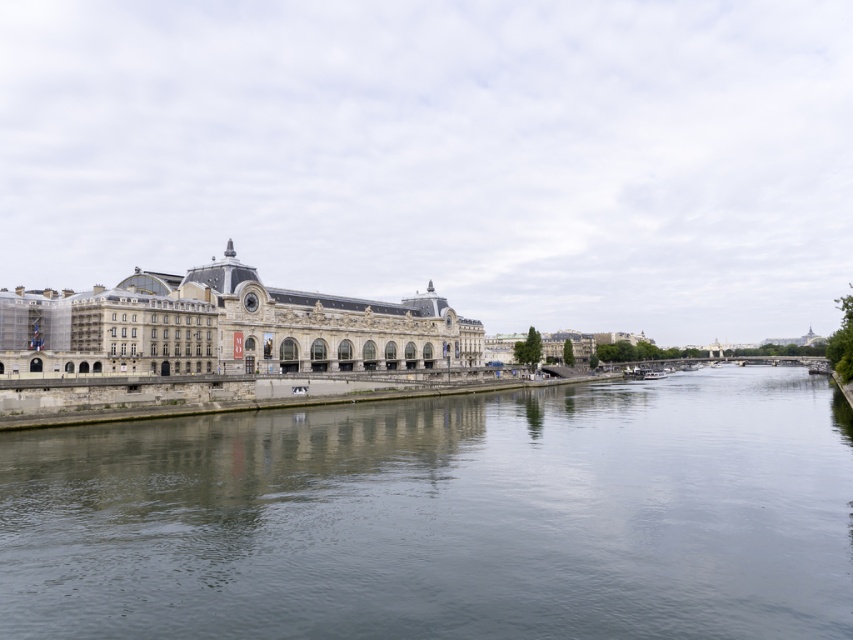
Which of these two, smooth gray water at center or stone building at center, stands shorter?

Standing shorter between the two is smooth gray water at center.

Is smooth gray water at center below stone building at center?

Yes, smooth gray water at center is below stone building at center.

I want to click on smooth gray water at center, so click(445, 516).